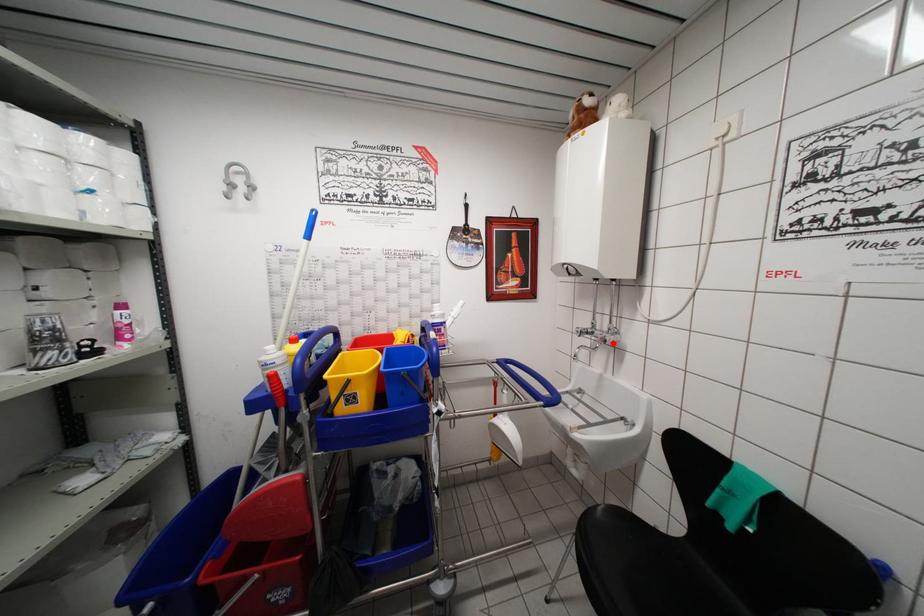
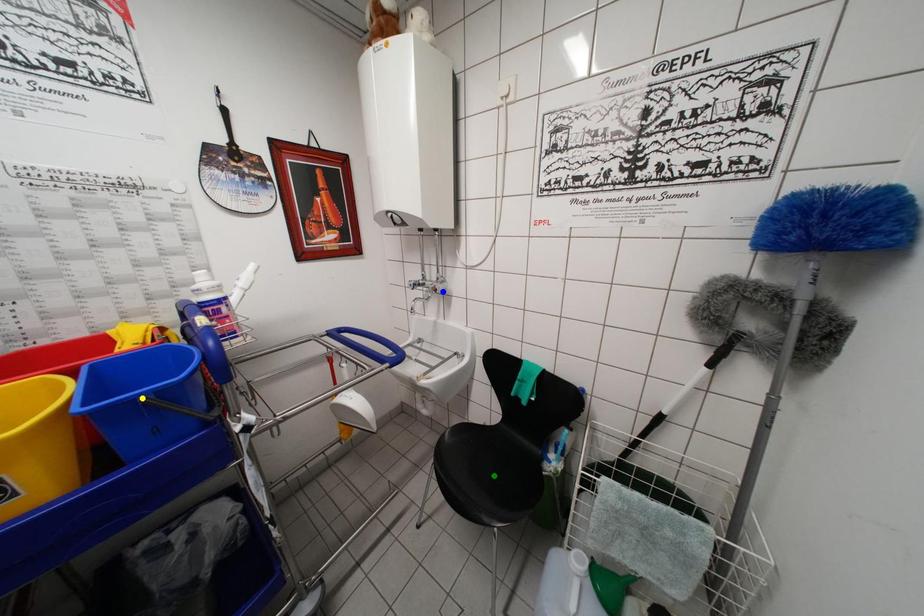
Question: I am providing you with two images of the same scene from different viewpoints. A red point is marked on the first image. You are given multiple points on the second image. Which point in image 2 represents the same 3d spot as the red point in image 1?

Choices:
 (A) blue point
 (B) green point
 (C) yellow point

Answer: (A)